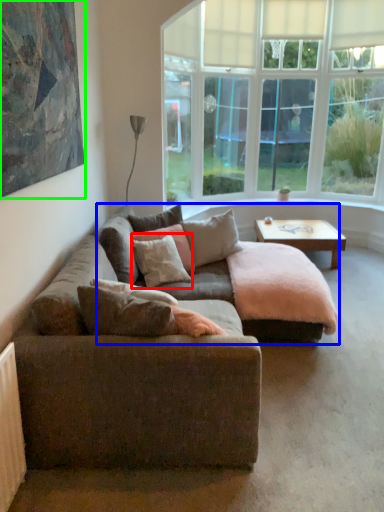
Question: Which object is the farthest from pillow (highlighted by a red box)? Choose among these: couch (highlighted by a blue box) or picture frame (highlighted by a green box).

Choices:
 (A) couch
 (B) picture frame

Answer: (B)